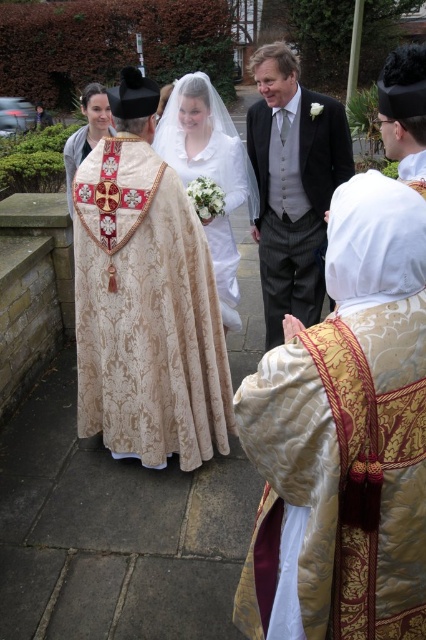
You are a photographer at the wedding and need to adjust the camera focus to ensure both the dark gray suit at center and the matte gold vestment at center are in focus. Given their height difference, which object should you focus on first to ensure proper depth of field?

The dark gray suit at center is taller than the matte gold vestment at center. To ensure proper depth of field, focus on the taller dark gray suit at center first, then adjust to include the shorter matte gold vestment at center.

You are standing in the wedding scene and want to place a bouquet between the two points marked as point (213, 97) and point (80, 156). Which point should the bouquet be closer to in order to be nearer to the bride?

The bouquet should be placed closer to point (213, 97) because it is closer to the viewer than point (80, 156), meaning it is nearer to the bride.